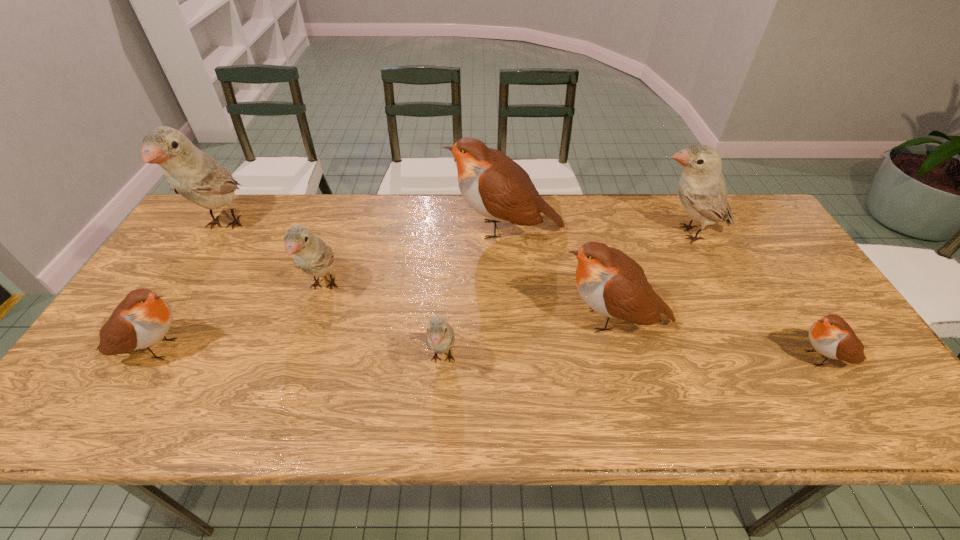
I want to click on the smallest brown bird, so click(831, 336).

Locate an element on the screen. The width and height of the screenshot is (960, 540). the rightmost brown bird is located at coordinates (831, 336).

The image size is (960, 540). Identify the location of vacant region located 0.400m at the face of the tallest object. (127, 380).

Where is `vacant region located at the face of the farthest brown bird`? Image resolution: width=960 pixels, height=540 pixels. vacant region located at the face of the farthest brown bird is located at coordinates (324, 229).

You are a GUI agent. You are given a task and a screenshot of the screen. Output one action in this format:
    pyautogui.click(x=<x>, y=<y>)
    Task: Click on the free space located 0.330m at the face of the farthest brown bird
    
    Given the screenshot: What is the action you would take?
    [x=343, y=229]

Where is `vacant position located at the face of the farthest brown bird`? The height and width of the screenshot is (540, 960). vacant position located at the face of the farthest brown bird is located at coordinates (326, 229).

Where is `vacant region located 0.190m at the face of the rightmost white bird`? vacant region located 0.190m at the face of the rightmost white bird is located at coordinates click(585, 233).

The height and width of the screenshot is (540, 960). In order to click on vacant space located at the face of the rightmost white bird in this screenshot , I will do `click(578, 233)`.

Locate an element on the screen. The image size is (960, 540). vacant space located at the face of the rightmost white bird is located at coordinates (626, 233).

You are a GUI agent. You are given a task and a screenshot of the screen. Output one action in this format:
    pyautogui.click(x=<x>, y=<y>)
    Task: Click on the free region located 0.340m at the face of the third smallest brown bird
    The width and height of the screenshot is (960, 540).
    Given the screenshot: What is the action you would take?
    pyautogui.click(x=422, y=320)